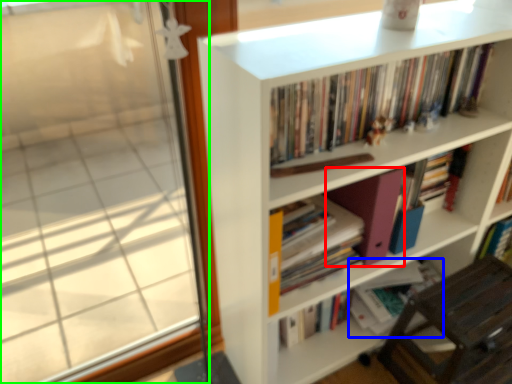
Question: Considering the real-world distances, which object is farthest from paperback book (highlighted by a red box)? book (highlighted by a blue box) or window (highlighted by a green box)?

Choices:
 (A) book
 (B) window

Answer: (B)